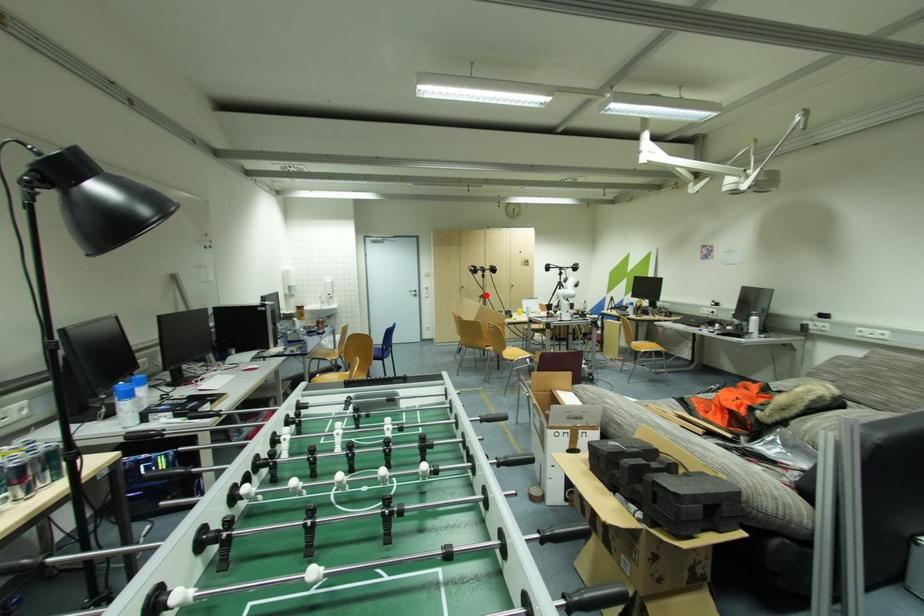
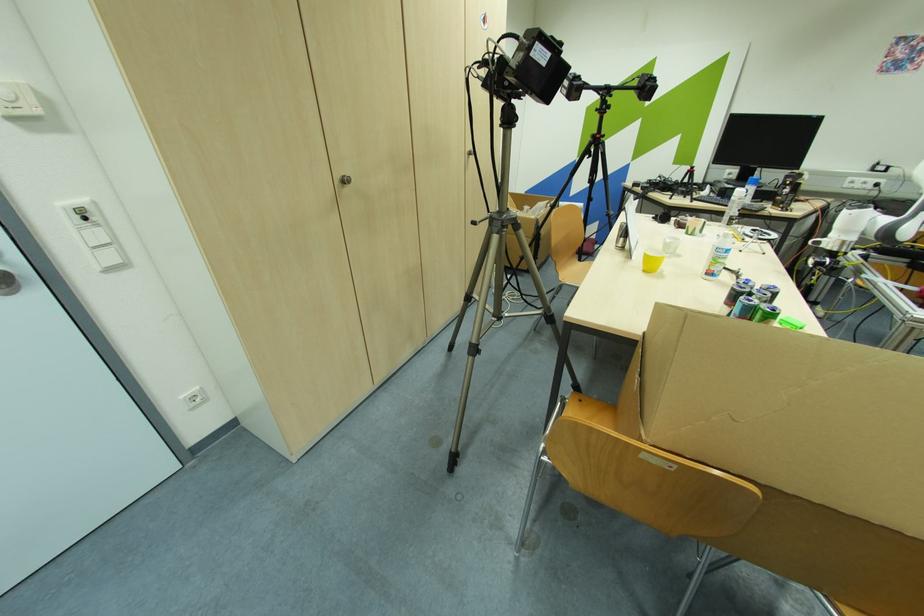
Locate, in the second image, the point that corresponds to the highlighted location in the first image.

(504, 214)